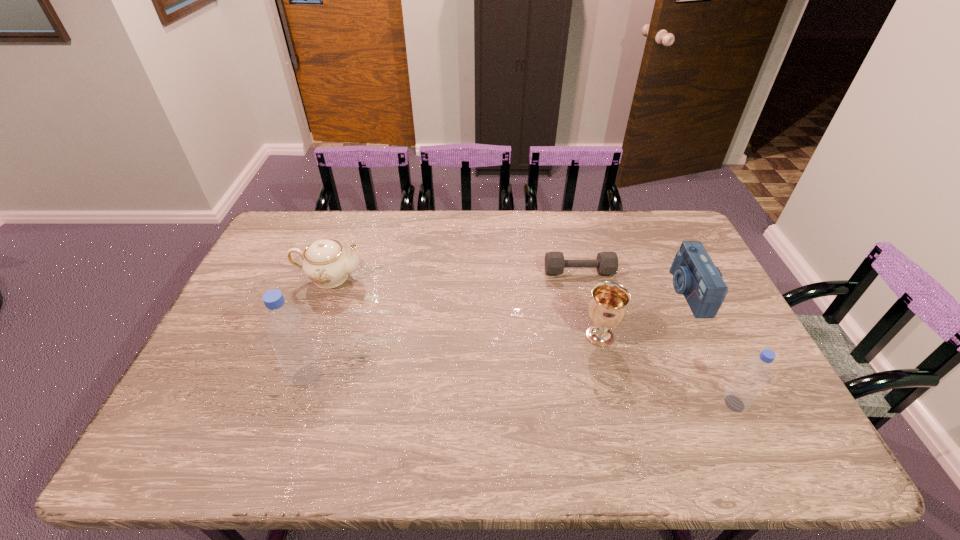
The width and height of the screenshot is (960, 540). Identify the location of vacant region at the far edge of the desktop. (468, 248).

Identify the location of vacant space at the near edge of the desktop. (590, 406).

Locate an element on the screen. The width and height of the screenshot is (960, 540). vacant area at the left edge is located at coordinates (249, 281).

This screenshot has width=960, height=540. Identify the location of free space at the far left corner of the desktop. (288, 245).

In the image, there is a desktop. What are the coordinates of `vacant space at the far right corner` in the screenshot? It's located at (x=665, y=211).

Locate an element on the screen. The height and width of the screenshot is (540, 960). free space at the near right corner of the desktop is located at coordinates (758, 421).

I want to click on empty space that is in between the fourth farthest object and the fifth shortest object, so click(x=667, y=370).

You are a GUI agent. You are given a task and a screenshot of the screen. Output one action in this format:
    pyautogui.click(x=<x>, y=<y>)
    Task: Click on the empty space that is in between the shortest object and the fifth shortest object
    Image resolution: width=960 pixels, height=540 pixels.
    Given the screenshot: What is the action you would take?
    pyautogui.click(x=657, y=338)

This screenshot has width=960, height=540. I want to click on free space between the farther bottle and the third nearest object, so tap(453, 356).

Where is `free space between the camera and the chalice`? The image size is (960, 540). free space between the camera and the chalice is located at coordinates (644, 314).